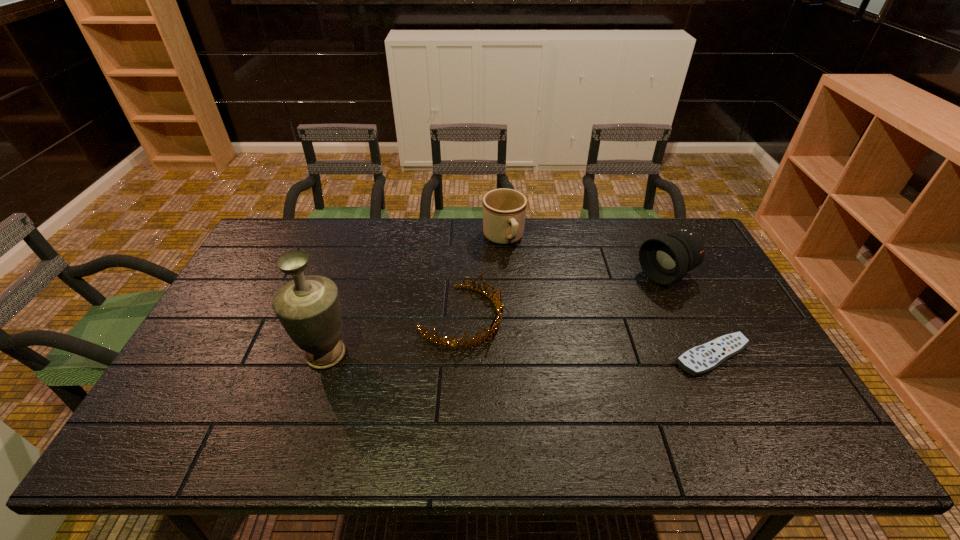
Identify the location of free space on the desktop that is between the urn and the remote control and is positioned on the side of the farthest object with the handle. The image size is (960, 540). (558, 355).

This screenshot has width=960, height=540. What are the coordinates of `free space on the desktop that is between the leftmost object and the shortest object and is positioned at the front element of the telephoto lens` in the screenshot? It's located at (510, 355).

Locate an element on the screen. The image size is (960, 540). free space on the desktop that is between the tallest object and the shortest object and is positioned on the front-facing side of the tiara is located at coordinates (548, 355).